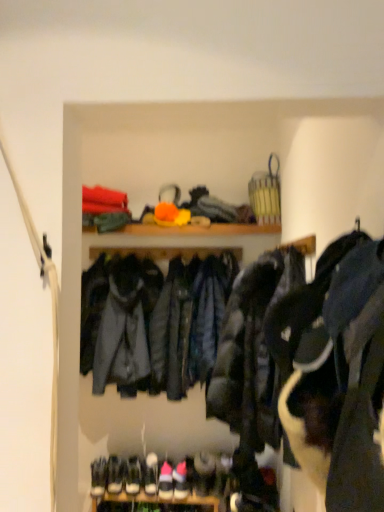
Locate an element on the screen. This screenshot has width=384, height=512. dark gray puffer jacket at center, placed as the 1th jacket when sorted from front to back is located at coordinates (252, 351).

What is the approximate height of white suede sneaker at lower center, marked as the second footwear in a left-to-right arrangement?

white suede sneaker at lower center, marked as the second footwear in a left-to-right arrangement, is 10.62 centimeters tall.

The height and width of the screenshot is (512, 384). What do you see at coordinates (199, 229) in the screenshot?
I see `yellow fabric basket at upper center` at bounding box center [199, 229].

In order to click on dark gray puffer jacket at center, marked as the second jacket in a back-to-front arrangement in this screenshot , I will do `click(252, 351)`.

Is point (159, 234) closer or farther from the camera than point (167, 484)?

Point (159, 234) appears to be closer to the viewer than point (167, 484).

Is yellow fabric basket at upper center at the right side of white suede sneaker at lower center, which is the second footwear in right-to-left order?

Correct, you'll find yellow fabric basket at upper center to the right of white suede sneaker at lower center, which is the second footwear in right-to-left order.

Does yellow fabric basket at upper center have a lesser height compared to white suede sneaker at lower center, marked as the second footwear in a left-to-right arrangement?

Yes, yellow fabric basket at upper center is shorter than white suede sneaker at lower center, marked as the second footwear in a left-to-right arrangement.

Considering the points (210, 461) and (224, 469), which point is in front, point (210, 461) or point (224, 469)?

Point (224, 469)

Can you confirm if white leather sneaker at lower center, marked as the 2th shoe in a right-to-left arrangement, is wider than white leather sneaker at lower center, which is the 1th shoe in right-to-left order?

No.

From the picture: Are white leather sneaker at lower center, placed as the first shoe when sorted from left to right, and white leather sneaker at lower center, placed as the 2th shoe when sorted from left to right, making contact?

Indeed, white leather sneaker at lower center, placed as the first shoe when sorted from left to right, and white leather sneaker at lower center, placed as the 2th shoe when sorted from left to right, are beside each other and touching.

Could you tell me if white suede sneakers at lower center, the first footwear when ordered from left to right, is turned towards dark blue leather jacket at center, acting as the second jacket starting from the front?

No, white suede sneakers at lower center, the first footwear when ordered from left to right, does not turn towards dark blue leather jacket at center, acting as the second jacket starting from the front.

Can you tell me how much white suede sneakers at lower center, the first footwear when ordered from left to right, and dark blue leather jacket at center, acting as the first jacket starting from the back, differ in facing direction?

white suede sneakers at lower center, the first footwear when ordered from left to right, and dark blue leather jacket at center, acting as the first jacket starting from the back, are facing 7.63 degrees away from each other.

Is white suede sneakers at lower center, which ranks as the 3th footwear in right-to-left order, touching dark blue leather jacket at center, acting as the first jacket starting from the back?

They are not placed beside each other.

From the image's perspective, is white suede sneakers at lower center, which ranks as the 3th footwear in right-to-left order, located beneath dark blue leather jacket at center, acting as the second jacket starting from the front?

Yes, from the image's perspective, white suede sneakers at lower center, which ranks as the 3th footwear in right-to-left order, is below dark blue leather jacket at center, acting as the second jacket starting from the front.

Is white leather sneaker at lower center, placed as the 2th shoe when sorted from left to right, taller or shorter than yellow fabric basket at upper center?

Considering their sizes, white leather sneaker at lower center, placed as the 2th shoe when sorted from left to right, has more height than yellow fabric basket at upper center.

Looking at this image, from the image's perspective, who appears lower, white leather sneaker at lower center, which is the 1th shoe in right-to-left order, or yellow fabric basket at upper center?

white leather sneaker at lower center, which is the 1th shoe in right-to-left order.

Which is more to the right, white leather sneaker at lower center, placed as the first shoe when sorted from left to right, or white suede sneakers at lower center, the first footwear when ordered from left to right?

Positioned to the right is white leather sneaker at lower center, placed as the first shoe when sorted from left to right.

Relative to white suede sneakers at lower center, the first footwear when ordered from left to right, is white leather sneaker at lower center, marked as the 2th shoe in a right-to-left arrangement, in front or behind?

white leather sneaker at lower center, marked as the 2th shoe in a right-to-left arrangement, is in front of white suede sneakers at lower center, the first footwear when ordered from left to right.

Who is smaller, white leather sneaker at lower center, placed as the first shoe when sorted from left to right, or white suede sneakers at lower center, which ranks as the 3th footwear in right-to-left order?

white suede sneakers at lower center, which ranks as the 3th footwear in right-to-left order.

How different are the orientations of white leather sneaker at lower center, marked as the 2th shoe in a right-to-left arrangement, and white suede sneakers at lower center, the first footwear when ordered from left to right, in degrees?

4.1 degrees separate the facing orientations of white leather sneaker at lower center, marked as the 2th shoe in a right-to-left arrangement, and white suede sneakers at lower center, the first footwear when ordered from left to right.

Does yellow fabric basket at upper center turn towards white suede sneakers at lower center, placed as the first footwear when sorted from right to left?

No, yellow fabric basket at upper center is not turned towards white suede sneakers at lower center, placed as the first footwear when sorted from right to left.

How different are the orientations of yellow fabric basket at upper center and white suede sneakers at lower center, the 3th footwear in the left-to-right sequence, in degrees?

The angle between the facing direction of yellow fabric basket at upper center and the facing direction of white suede sneakers at lower center, the 3th footwear in the left-to-right sequence, is 6.04 degrees.

Considering the points (179, 231) and (180, 470), which point is in front, point (179, 231) or point (180, 470)?

The point (179, 231) is in front.

Which is closer to the camera, (179, 484) or (218, 459)?

The point (179, 484) is closer to the camera.

Between white suede sneakers at lower center, the 3th footwear in the left-to-right sequence, and white leather sneaker at lower center, placed as the 2th shoe when sorted from left to right, which one has smaller width?

white leather sneaker at lower center, placed as the 2th shoe when sorted from left to right.

In order to click on shelf above the white suede sneaker at lower center, which is the second footwear in right-to-left order (from the image's perspective) in this screenshot , I will do `click(199, 229)`.

The height and width of the screenshot is (512, 384). I want to click on shoe that appears on the right of white leather sneaker at lower center, placed as the first shoe when sorted from left to right, so click(x=222, y=473).

When comparing their distances from white suede sneaker at lower center, marked as the second footwear in a left-to-right arrangement, does dark gray puffer jacket at center, placed as the 1th jacket when sorted from front to back, or white leather sneaker at lower center, placed as the 2th shoe when sorted from left to right, seem further?

dark gray puffer jacket at center, placed as the 1th jacket when sorted from front to back, lies further to white suede sneaker at lower center, marked as the second footwear in a left-to-right arrangement, than the other object.

When comparing their distances from dark blue leather jacket at center, acting as the second jacket starting from the front, does white suede sneaker at lower center, which is the second footwear in right-to-left order, or white suede sneakers at lower center, the 3th footwear in the left-to-right sequence, seem further?

The object further to dark blue leather jacket at center, acting as the second jacket starting from the front, is white suede sneakers at lower center, the 3th footwear in the left-to-right sequence.

Looking at the image, which one is located further to white suede sneakers at lower center, the 3th footwear in the left-to-right sequence, yellow fabric basket at upper center or dark gray puffer jacket at center, placed as the 1th jacket when sorted from front to back?

yellow fabric basket at upper center.

Estimate the real-world distances between objects in this image. Which object is closer to white leather sneaker at lower center, placed as the 2th shoe when sorted from left to right, white suede sneaker at lower center, marked as the second footwear in a left-to-right arrangement, or white suede sneakers at lower center, the 3th footwear in the left-to-right sequence?

white suede sneakers at lower center, the 3th footwear in the left-to-right sequence, is positioned closer to the anchor white leather sneaker at lower center, placed as the 2th shoe when sorted from left to right.

Based on the photo, looking at the image, which one is located further to white suede sneakers at lower center, placed as the first footwear when sorted from right to left, dark blue leather jacket at center, acting as the first jacket starting from the back, or white suede sneaker at lower center, which is the second footwear in right-to-left order?

Based on the image, dark blue leather jacket at center, acting as the first jacket starting from the back, appears to be further to white suede sneakers at lower center, placed as the first footwear when sorted from right to left.

Looking at the image, which one is located further to white suede sneakers at lower center, which ranks as the 3th footwear in right-to-left order, white suede sneakers at lower center, placed as the first footwear when sorted from right to left, or dark gray puffer jacket at center, placed as the 1th jacket when sorted from front to back?

The object further to white suede sneakers at lower center, which ranks as the 3th footwear in right-to-left order, is dark gray puffer jacket at center, placed as the 1th jacket when sorted from front to back.

Based on their spatial positions, is white leather sneaker at lower center, placed as the 2th shoe when sorted from left to right, or dark blue leather jacket at center, acting as the first jacket starting from the back, closer to white suede sneakers at lower center, the first footwear when ordered from left to right?

white leather sneaker at lower center, placed as the 2th shoe when sorted from left to right, is closer to white suede sneakers at lower center, the first footwear when ordered from left to right.

Which object lies nearer to the anchor point dark blue leather jacket at center, acting as the first jacket starting from the back, yellow fabric basket at upper center or white leather sneaker at lower center, which is the 1th shoe in right-to-left order?

Among the two, yellow fabric basket at upper center is located nearer to dark blue leather jacket at center, acting as the first jacket starting from the back.

This screenshot has height=512, width=384. What are the coordinates of `shoe that lies between dark blue leather jacket at center, acting as the first jacket starting from the back, and white leather sneaker at lower center, which is the 1th shoe in right-to-left order, from top to bottom` in the screenshot? It's located at (203, 473).

Identify the location of jacket between dark gray puffer jacket at center, marked as the second jacket in a back-to-front arrangement, and white leather sneaker at lower center, which is the 1th shoe in right-to-left order, from front to back. Image resolution: width=384 pixels, height=512 pixels. (153, 323).

Locate an element on the screen. The width and height of the screenshot is (384, 512). footwear between white suede sneaker at lower center, marked as the second footwear in a left-to-right arrangement, and white leather sneaker at lower center, placed as the first shoe when sorted from left to right, from left to right is located at coordinates (181, 481).

This screenshot has width=384, height=512. I want to click on shoe that lies between yellow fabric basket at upper center and white leather sneaker at lower center, placed as the 2th shoe when sorted from left to right, from top to bottom, so click(203, 473).